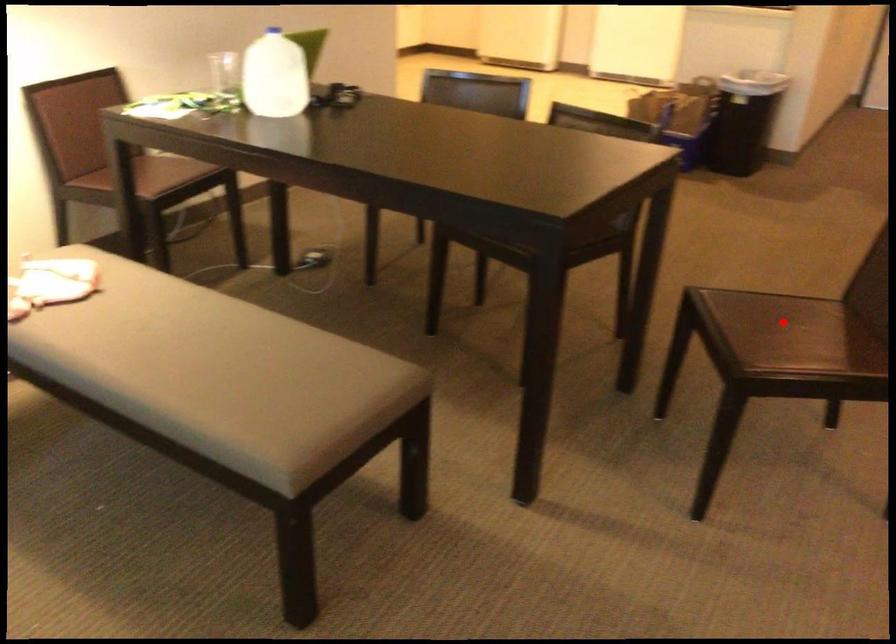
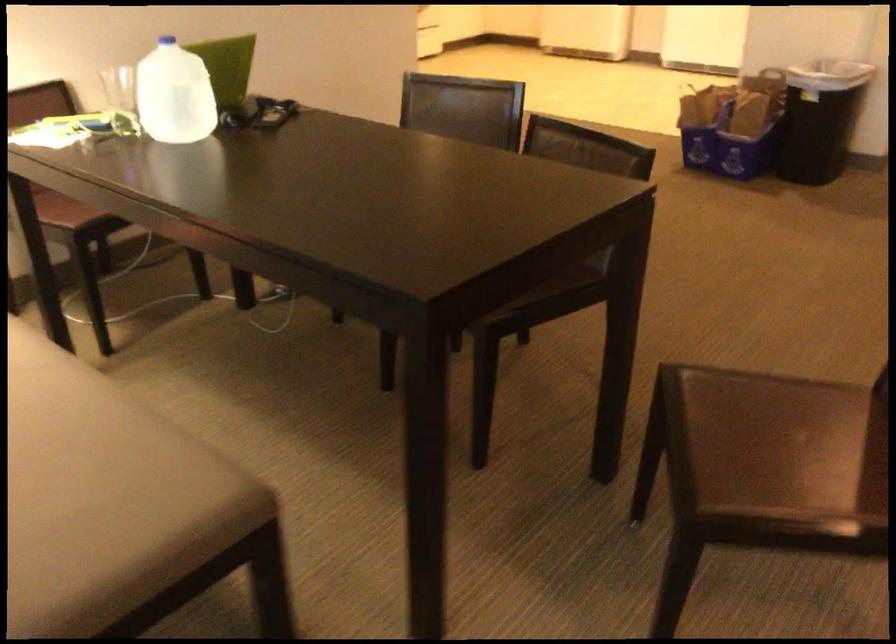
Question: I am providing you with two images of the same scene from different viewpoints. A red point is marked on the first image. Is the red point's position out of view in image 2?

Choices:
 (A) Yes
 (B) No

Answer: (B)